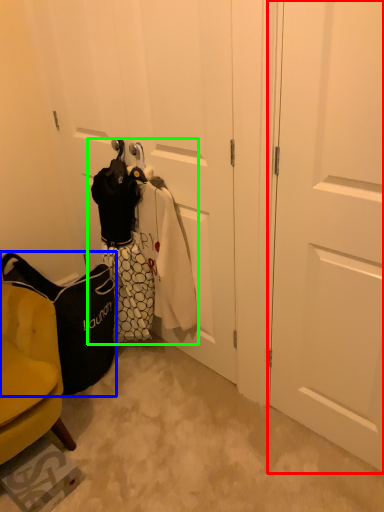
Question: Which object is positioned farthest from door (highlighted by a red box)? Select from handbag (highlighted by a blue box) and laundry (highlighted by a green box).

Choices:
 (A) handbag
 (B) laundry

Answer: (A)